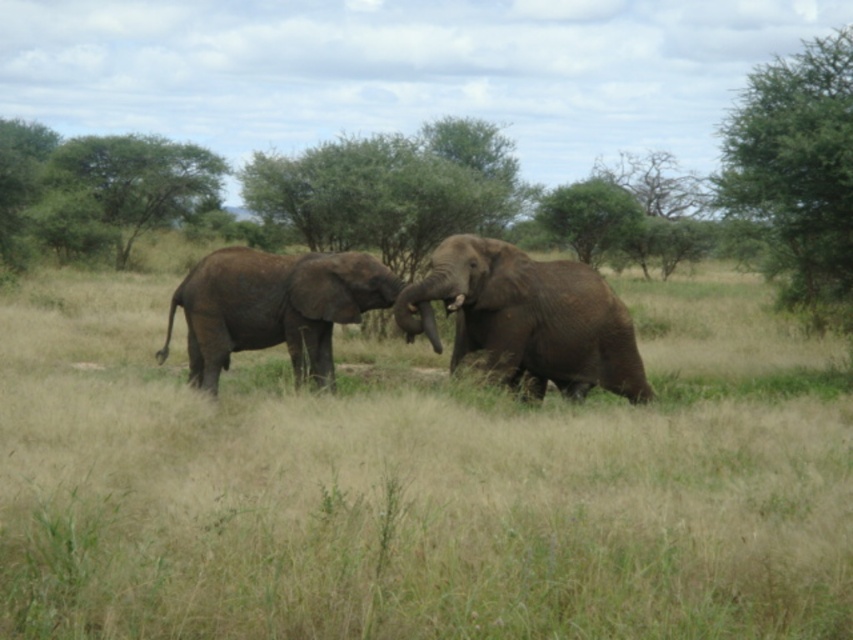
Does green leafy tree at upper left appear over green leafy tree at center?

Correct, green leafy tree at upper left is located above green leafy tree at center.

Is green leafy tree at upper left below green leafy tree at center?

Actually, green leafy tree at upper left is above green leafy tree at center.

What do you see at coordinates (138, 180) in the screenshot? This screenshot has width=853, height=640. I see `green leafy tree at upper left` at bounding box center [138, 180].

What are the coordinates of `green leafy tree at upper left` in the screenshot? It's located at (138, 180).

Is point (833, 61) in front of point (325, 296)?

No.

Between green leafy tree at upper right and brown textured elephant at left, which one has less height?

brown textured elephant at left is shorter.

Find the location of a particular element. The width and height of the screenshot is (853, 640). green leafy tree at upper right is located at coordinates (795, 172).

The width and height of the screenshot is (853, 640). I want to click on green leafy tree at upper right, so click(x=795, y=172).

Is point (825, 184) positioned before point (171, 147)?

Yes, it is.

This screenshot has width=853, height=640. Identify the location of green leafy tree at upper right. (795, 172).